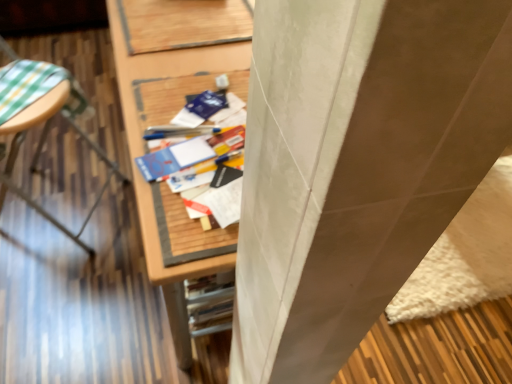
Question: From a real-world perspective, is matte blue paperback book at center, arranged as the 1th paperback book when ordered from the bottom, positioned above or below wooden table at left, which is the second furniture from right to left?

Choices:
 (A) below
 (B) above

Answer: (B)

Question: Does point (155, 178) appear closer or farther from the camera than point (10, 96)?

Choices:
 (A) closer
 (B) farther

Answer: (A)

Question: Based on their relative distances, which object is nearer to the matte blue paperback book at center, acting as the 2th paperback book starting from the back?

Choices:
 (A) blue matte paper at center, acting as the 1th paperback book starting from the back
 (B) wooden desk at center, which is counted as the first furniture, starting from the right
 (C) wooden table at left, positioned as the 1th furniture in left-to-right order

Answer: (A)

Question: Estimate the real-world distances between objects in this image. Which object is closer to the matte blue paperback book at center, the 2th paperback book positioned from the top?

Choices:
 (A) wooden desk at center, acting as the 2th furniture starting from the left
 (B) wooden table at left, which is the second furniture from right to left
 (C) blue matte paper at center, which ranks as the 2th paperback book in front-to-back order

Answer: (C)